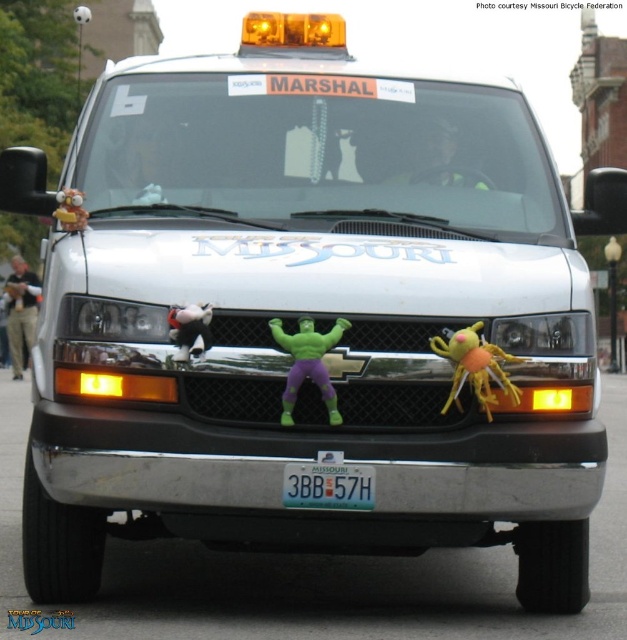
Question: From the image, what is the correct spatial relationship of green rubber toy at center in relation to plush yellow monkey at left?

Choices:
 (A) right
 (B) left

Answer: (A)

Question: Among these objects, which one is farthest from the camera?

Choices:
 (A) yellow fuzzy spider at center
 (B) plush yellow monkey at left
 (C) blue metallic license plate at center

Answer: (B)

Question: Which object appears closest to the camera in this image?

Choices:
 (A) white plush duck at center
 (B) blue metallic license plate at center

Answer: (B)

Question: Is blue metallic license plate at center to the left of green rubber toy at center from the viewer's perspective?

Choices:
 (A) yes
 (B) no

Answer: (B)

Question: Among these objects, which one is nearest to the camera?

Choices:
 (A) green rubber toy at center
 (B) white plush duck at center
 (C) plush yellow monkey at left
 (D) yellow fuzzy spider at center

Answer: (A)

Question: Is yellow fuzzy spider at center further to the viewer compared to white plush duck at center?

Choices:
 (A) no
 (B) yes

Answer: (A)